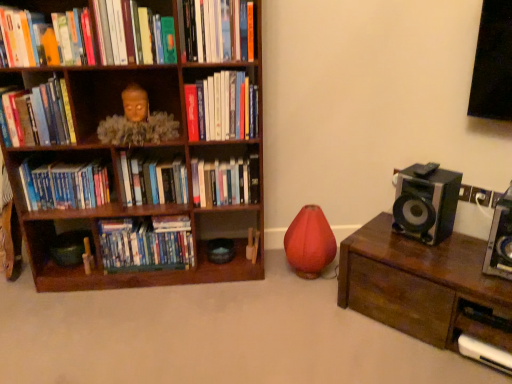
This screenshot has width=512, height=384. Describe the element at coordinates (137, 122) in the screenshot. I see `wooden statue at upper left` at that location.

Where is `wooden chest at right`? This screenshot has width=512, height=384. wooden chest at right is located at coordinates (424, 286).

This screenshot has height=384, width=512. I want to click on hardcover book at center, arranged as the sixth book when ordered from the bottom, so click(222, 107).

Measure the distance between hardcover books at center, the fourth book ordered from the bottom, and camera.

The distance of hardcover books at center, the fourth book ordered from the bottom, from camera is 2.10 meters.

Find the location of `wooden rolling pin at lower left`. wooden rolling pin at lower left is located at coordinates (58, 245).

At what (x,y) coordinates should I click in order to perform the action: click on hardcover book at left, which ranks as the fifth book in bottom-to-top order. Please return your answer as a coordinate pair (x, y). This screenshot has height=384, width=512. Looking at the image, I should click on (38, 115).

I want to click on wooden statue at upper left, so click(x=137, y=122).

Which is correct: matte orange book at upper left, which is the seventh book from bottom to top, is inside hardcover book at left, the 5th book when ordered from top to bottom, or outside of it?

matte orange book at upper left, which is the seventh book from bottom to top, lies outside hardcover book at left, the 5th book when ordered from top to bottom.

From the image's perspective, is matte orange book at upper left, which is the seventh book from bottom to top, below hardcover book at left, the 5th book when ordered from top to bottom?

No.

Which is more to the left, matte orange book at upper left, acting as the 3th book starting from the top, or hardcover book at left, the 5th book when ordered from top to bottom?

hardcover book at left, the 5th book when ordered from top to bottom, is more to the left.

Is black plastic speaker at right, which ranks as the second speaker in right-to-left order, aimed at hardcover books at center, marked as the 6th book in a top-to-bottom arrangement?

No, black plastic speaker at right, which ranks as the second speaker in right-to-left order, is not aimed at hardcover books at center, marked as the 6th book in a top-to-bottom arrangement.

Is black plastic speaker at right, which is counted as the first speaker, starting from the left, smaller than hardcover books at center, marked as the 6th book in a top-to-bottom arrangement?

Actually, black plastic speaker at right, which is counted as the first speaker, starting from the left, might be larger than hardcover books at center, marked as the 6th book in a top-to-bottom arrangement.

Is the position of black plastic speaker at right, which ranks as the second speaker in right-to-left order, less distant than that of hardcover books at center, the fourth book ordered from the bottom?

Yes, the depth of black plastic speaker at right, which ranks as the second speaker in right-to-left order, is less than that of hardcover books at center, the fourth book ordered from the bottom.

Considering the sizes of black plastic speaker at right, which is counted as the first speaker, starting from the left, and hardcover books at center, marked as the 6th book in a top-to-bottom arrangement, in the image, is black plastic speaker at right, which is counted as the first speaker, starting from the left, taller or shorter than hardcover books at center, marked as the 6th book in a top-to-bottom arrangement,?

In the image, black plastic speaker at right, which is counted as the first speaker, starting from the left, appears to be taller than hardcover books at center, marked as the 6th book in a top-to-bottom arrangement.

Considering the relative sizes of black plastic speaker at right, which is counted as the first speaker, starting from the left, and wooden chest at right in the image provided, is black plastic speaker at right, which is counted as the first speaker, starting from the left, wider than wooden chest at right?

No.

How distant is black plastic speaker at right, which is counted as the first speaker, starting from the left, from wooden chest at right?

black plastic speaker at right, which is counted as the first speaker, starting from the left, and wooden chest at right are 9.11 inches apart from each other.

Is point (438, 204) positioned in front of point (485, 332)?

No, it is behind (485, 332).

Consider the image. From the image's perspective, would you say black plastic speaker at right, which is counted as the first speaker, starting from the left, is positioned over wooden chest at right?

Yes, from the image's perspective, black plastic speaker at right, which is counted as the first speaker, starting from the left, is above wooden chest at right.

Considering the positions of objects matte green book at upper center, which is counted as the second book, starting from the top, and matte red vase at center in the image provided, who is behind, matte green book at upper center, which is counted as the second book, starting from the top, or matte red vase at center?

matte red vase at center.

From the picture: Is the surface of matte green book at upper center, which is counted as the second book, starting from the top, in direct contact with matte red vase at center?

No, matte green book at upper center, which is counted as the second book, starting from the top, is not making contact with matte red vase at center.

Is matte green book at upper center, which is counted as the second book, starting from the top, oriented towards matte red vase at center?

No, matte green book at upper center, which is counted as the second book, starting from the top, is not facing towards matte red vase at center.

Considering the sizes of matte green book at upper center, the eighth book from the bottom, and matte red vase at center in the image, is matte green book at upper center, the eighth book from the bottom, bigger or smaller than matte red vase at center?

In the image, matte green book at upper center, the eighth book from the bottom, appears to be smaller than matte red vase at center.

Considering the points (234, 198) and (240, 245), which point is in front, point (234, 198) or point (240, 245)?

Positioned in front is point (234, 198).

Which is more to the right, hardcover books at center, arranged as the second book when ordered from the bottom, or brown wooden bookcase at left?

Positioned to the right is hardcover books at center, arranged as the second book when ordered from the bottom.

From the picture: Does hardcover books at center, arranged as the second book when ordered from the bottom, have a lesser width compared to brown wooden bookcase at left?

Correct, the width of hardcover books at center, arranged as the second book when ordered from the bottom, is less than that of brown wooden bookcase at left.

Who is taller, hardcover books at center, the 8th book viewed from the top, or brown wooden bookcase at left?

Standing taller between the two is brown wooden bookcase at left.

Is wooden chest at right to the left or to the right of metallic silver speaker at right, the second speaker positioned from the left, in the image?

From the image, it's evident that wooden chest at right is to the left of metallic silver speaker at right, the second speaker positioned from the left.

Could you measure the distance between wooden chest at right and metallic silver speaker at right, the second speaker positioned from the left?

wooden chest at right and metallic silver speaker at right, the second speaker positioned from the left, are 10.42 inches apart from each other.

How many degrees apart are the facing directions of wooden chest at right and metallic silver speaker at right, the second speaker positioned from the left?

There is a 2.49-degree angle between the facing directions of wooden chest at right and metallic silver speaker at right, the second speaker positioned from the left.

Can you see wooden chest at right touching metallic silver speaker at right, the second speaker positioned from the left?

No, wooden chest at right is not making contact with metallic silver speaker at right, the second speaker positioned from the left.

Considering the sizes of hardcover books at center, arranged as the second book when ordered from the bottom, and matte green book at upper center, which is counted as the second book, starting from the top, in the image, is hardcover books at center, arranged as the second book when ordered from the bottom, taller or shorter than matte green book at upper center, which is counted as the second book, starting from the top,?

In the image, hardcover books at center, arranged as the second book when ordered from the bottom, appears to be shorter than matte green book at upper center, which is counted as the second book, starting from the top.

Is hardcover books at center, the 8th book viewed from the top, inside or outside of matte green book at upper center, the eighth book from the bottom?

hardcover books at center, the 8th book viewed from the top, exists outside the volume of matte green book at upper center, the eighth book from the bottom.

This screenshot has width=512, height=384. Find the location of `the 4th book in front of the hardcover books at center, the 8th book viewed from the top, starting your count from the anchor`. the 4th book in front of the hardcover books at center, the 8th book viewed from the top, starting your count from the anchor is located at coordinates (133, 34).

Which object is closer to the camera taking this photo, hardcover books at center, arranged as the second book when ordered from the bottom, or matte green book at upper center, the eighth book from the bottom?

matte green book at upper center, the eighth book from the bottom, is closer to the camera.

This screenshot has height=384, width=512. I want to click on the 3rd book directly above the hardcover book at left, which ranks as the fifth book in bottom-to-top order (from a real-world perspective), so click(x=45, y=38).

Locate an element on the screen. book that is the 4th one when counting leftward from the black plastic speaker at right, which is counted as the first speaker, starting from the left is located at coordinates (153, 181).

Estimate the real-world distances between objects in this image. Which object is further from black plastic speaker at right, which ranks as the second speaker in right-to-left order, hardcover books at left, the 3th book in the bottom-to-top sequence, or hardcover book at center, arranged as the sixth book when ordered from the bottom?

Based on the image, hardcover books at left, the 3th book in the bottom-to-top sequence, appears to be further to black plastic speaker at right, which ranks as the second speaker in right-to-left order.

Looking at the image, which one is located closer to wooden statue at upper left, wooden chest at right or hardcover books at left, the seventh book viewed from the top?

hardcover books at left, the seventh book viewed from the top, is positioned closer to the anchor wooden statue at upper left.

Looking at the image, which one is located closer to brown wooden bookcase at left, hardcover books at center, marked as the 6th book in a top-to-bottom arrangement, or hardcover book at upper center, the first book positioned from the top?

hardcover books at center, marked as the 6th book in a top-to-bottom arrangement, is positioned closer to the anchor brown wooden bookcase at left.

When comparing their distances from matte red vase at center, does matte green book at upper center, which is counted as the second book, starting from the top, or black plastic speaker at right, which ranks as the second speaker in right-to-left order, seem closer?

Based on the image, black plastic speaker at right, which ranks as the second speaker in right-to-left order, appears to be nearer to matte red vase at center.

When comparing their distances from matte plastic dvds at lower left, which is counted as the first book, starting from the bottom, does metallic silver speaker at right, the first speaker from the right, or hardcover books at center, the 8th book viewed from the top, seem closer?

hardcover books at center, the 8th book viewed from the top, lies closer to matte plastic dvds at lower left, which is counted as the first book, starting from the bottom, than the other object.

Which object lies further to the anchor point hardcover book at upper center, which is the 9th book from bottom to top, hardcover book at left, which ranks as the fifth book in bottom-to-top order, or hardcover book at center, the 4th book viewed from the top?

hardcover book at left, which ranks as the fifth book in bottom-to-top order.

From the image, which object appears to be farther from wooden rolling pin at lower left, matte red vase at center or black plastic speaker at right, which is counted as the first speaker, starting from the left?

black plastic speaker at right, which is counted as the first speaker, starting from the left.

Based on their spatial positions, is metallic silver speaker at right, the first speaker from the right, or black plastic speaker at right, which is counted as the first speaker, starting from the left, closer to hardcover books at center, arranged as the second book when ordered from the bottom?

The object closer to hardcover books at center, arranged as the second book when ordered from the bottom, is black plastic speaker at right, which is counted as the first speaker, starting from the left.

This screenshot has height=384, width=512. I want to click on toy located between brown wooden bookcase at left and metallic silver speaker at right, the first speaker from the right, in the left-right direction, so click(x=309, y=242).

Find the location of a particular element. bookcase located between hardcover book at left, the 5th book when ordered from top to bottom, and matte green book at upper center, the eighth book from the bottom, in the left-right direction is located at coordinates (119, 178).

Locate an element on the screen. The image size is (512, 384). person between matte orange book at upper left, acting as the 3th book starting from the top, and matte plastic dvds at lower left, which is the 9th book in top-to-bottom order, in the up-down direction is located at coordinates (137, 122).

The height and width of the screenshot is (384, 512). In order to click on speaker situated between matte plastic dvds at lower left, which is the 9th book in top-to-bottom order, and metallic silver speaker at right, the first speaker from the right, from left to right in this screenshot , I will do `click(426, 203)`.